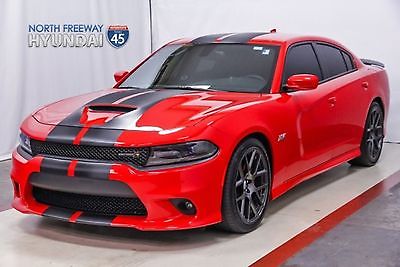
This screenshot has width=400, height=267. In order to click on sticker in this screenshot , I will do `click(268, 51)`, `click(256, 49)`.